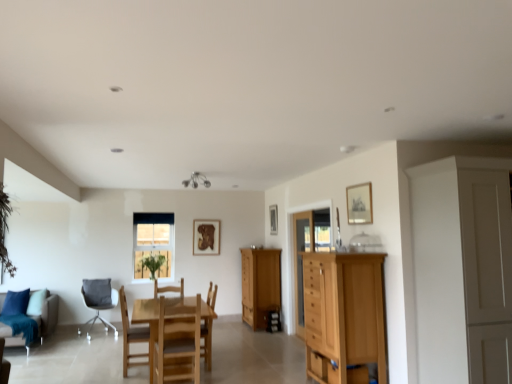
Question: Considering the relative positions of wooden frame at center and wooden cabinet at center in the image provided, is wooden frame at center to the left of wooden cabinet at center from the viewer's perspective?

Choices:
 (A) yes
 (B) no

Answer: (A)

Question: Considering the relative sizes of wooden frame at center and wooden cabinet at center in the image provided, is wooden frame at center taller than wooden cabinet at center?

Choices:
 (A) no
 (B) yes

Answer: (A)

Question: Considering the relative sizes of wooden frame at center and wooden cabinet at center in the image provided, is wooden frame at center wider than wooden cabinet at center?

Choices:
 (A) no
 (B) yes

Answer: (A)

Question: Can you confirm if wooden frame at center is bigger than wooden cabinet at center?

Choices:
 (A) no
 (B) yes

Answer: (A)

Question: From a real-world perspective, is wooden frame at center positioned under wooden cabinet at center based on gravity?

Choices:
 (A) no
 (B) yes

Answer: (A)

Question: Considering the positions of transparent glass cabinet at center, which is counted as the first glass door, starting from the left, and teal fabric couch at lower left in the image, is transparent glass cabinet at center, which is counted as the first glass door, starting from the left, wider or thinner than teal fabric couch at lower left?

Choices:
 (A) thin
 (B) wide

Answer: (A)

Question: Considering the positions of transparent glass cabinet at center, which is counted as the first glass door, starting from the left, and teal fabric couch at lower left in the image, is transparent glass cabinet at center, which is counted as the first glass door, starting from the left, taller or shorter than teal fabric couch at lower left?

Choices:
 (A) tall
 (B) short

Answer: (A)

Question: Considering the positions of transparent glass cabinet at center, the second glass door positioned from the right, and teal fabric couch at lower left in the image, is transparent glass cabinet at center, the second glass door positioned from the right, bigger or smaller than teal fabric couch at lower left?

Choices:
 (A) big
 (B) small

Answer: (B)

Question: From a real-world perspective, relative to teal fabric couch at lower left, is transparent glass cabinet at center, which is counted as the first glass door, starting from the left, vertically above or below?

Choices:
 (A) above
 (B) below

Answer: (A)

Question: Visually, is white fabric chair at lower left, marked as the 4th chair in a right-to-left arrangement, positioned to the left or to the right of wooden picture frame at upper center, positioned as the second picture frame in front-to-back order?

Choices:
 (A) left
 (B) right

Answer: (A)

Question: Relative to wooden picture frame at upper center, acting as the 2th picture frame starting from the left, is white fabric chair at lower left, which is the 1th chair from left to right, in front or behind?

Choices:
 (A) behind
 (B) front

Answer: (B)

Question: Looking at the image, does white fabric chair at lower left, which is the 1th chair from left to right, seem bigger or smaller compared to wooden picture frame at upper center, positioned as the second picture frame in front-to-back order?

Choices:
 (A) small
 (B) big

Answer: (B)

Question: Is white fabric chair at lower left, positioned as the 1th chair in back-to-front order, inside or outside of wooden picture frame at upper center, acting as the 2th picture frame starting from the left?

Choices:
 (A) outside
 (B) inside

Answer: (A)

Question: From the image's perspective, is wooden chair at center, the 2th chair positioned from the right, above or below transparent glass cabinet at center, which is counted as the first glass door, starting from the left?

Choices:
 (A) above
 (B) below

Answer: (B)

Question: Considering the positions of wooden chair at center, the 4th chair when ordered from back to front, and transparent glass cabinet at center, the second glass door positioned from the right, in the image, is wooden chair at center, the 4th chair when ordered from back to front, wider or thinner than transparent glass cabinet at center, the second glass door positioned from the right,?

Choices:
 (A) wide
 (B) thin

Answer: (A)